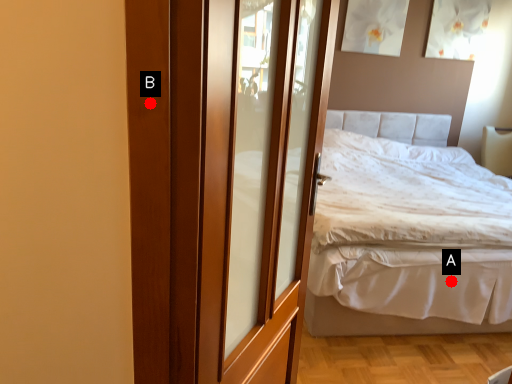
Question: Two points are circled on the image, labeled by A and B beside each circle. Which point is closer to the camera?

Choices:
 (A) A is closer
 (B) B is closer

Answer: (B)